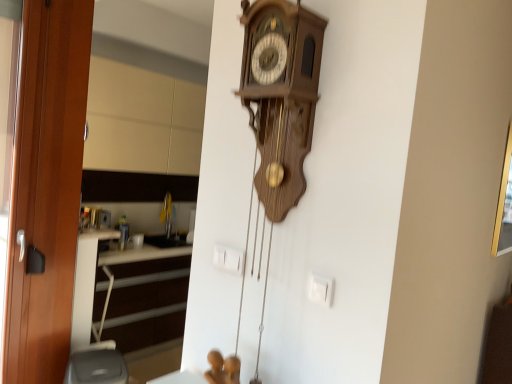
Locate an element on the screen. wooden door at left is located at coordinates (46, 188).

The width and height of the screenshot is (512, 384). Identify the location of wooden door at left. (46, 188).

Could you tell me if beige matte cabinet at upper left is facing white plastic electric outlet at center?

Yes, beige matte cabinet at upper left is aimed at white plastic electric outlet at center.

Does beige matte cabinet at upper left appear on the right side of white plastic electric outlet at center?

Incorrect, beige matte cabinet at upper left is not on the right side of white plastic electric outlet at center.

How distant is beige matte cabinet at upper left from white plastic electric outlet at center?

The distance of beige matte cabinet at upper left from white plastic electric outlet at center is 2.42 meters.

Which of these two, white plastic electric outlet at center or wooden door at left, is thinner?

Thinner between the two is white plastic electric outlet at center.

Is point (236, 270) closer or farther from the camera than point (33, 316)?

Clearly, point (236, 270) is closer to the camera than point (33, 316).

Is wooden door at left at the back of white plastic electric outlet at center?

No.

Based on the photo, from a real-world perspective, between white plastic electric outlet at center and wooden door at left, who is vertically higher?

In real-world perspective, white plastic electric outlet at center is above.

Is gold metallic picture frame at upper right completely or partially outside of wooden door at left?

Yes, gold metallic picture frame at upper right is located beyond the bounds of wooden door at left.

Considering the sizes of objects gold metallic picture frame at upper right and wooden door at left in the image provided, who is thinner, gold metallic picture frame at upper right or wooden door at left?

gold metallic picture frame at upper right.

Is gold metallic picture frame at upper right positioned with its back to wooden door at left?

gold metallic picture frame at upper right is not turned away from wooden door at left.

Does white plastic electric outlet at center have a greater height compared to gold metallic picture frame at upper right?

No.

From the image's perspective, is white plastic electric outlet at center located above gold metallic picture frame at upper right?

Actually, white plastic electric outlet at center appears below gold metallic picture frame at upper right in the image.

Is white plastic electric outlet at center positioned with its back to gold metallic picture frame at upper right?

Yes, white plastic electric outlet at center is facing away from gold metallic picture frame at upper right.

Which object is further away from the camera taking this photo, white plastic electric outlet at center or gold metallic picture frame at upper right?

gold metallic picture frame at upper right.

Is point (51, 295) positioned in front of point (241, 271)?

No.

Considering the relative sizes of wooden door at left and white plastic electric outlet at center in the image provided, is wooden door at left smaller than white plastic electric outlet at center?

Actually, wooden door at left might be larger than white plastic electric outlet at center.

Based on their positions, is wooden door at left located to the left or right of white plastic electric outlet at center?

Clearly, wooden door at left is on the left of white plastic electric outlet at center in the image.

How different are the orientations of wooden door at left and white plastic electric outlet at center in degrees?

The angle between the facing direction of wooden door at left and the facing direction of white plastic electric outlet at center is 89.9 degrees.

In the scene shown: From the image's perspective, is wooden door at left located above or below beige matte cabinet at upper left?

wooden door at left is below beige matte cabinet at upper left.

In order to click on mirror located behind the wooden door at left in this screenshot , I will do `click(144, 105)`.

Who is taller, wooden door at left or beige matte cabinet at upper left?

wooden door at left.

From a real-world perspective, between wooden door at left and beige matte cabinet at upper left, who is vertically higher?

In real-world perspective, beige matte cabinet at upper left is above.

Considering the sizes of objects gold metallic picture frame at upper right and white plastic electric outlet at center in the image provided, who is taller, gold metallic picture frame at upper right or white plastic electric outlet at center?

gold metallic picture frame at upper right is taller.

Is gold metallic picture frame at upper right oriented away from white plastic electric outlet at center?

No, gold metallic picture frame at upper right is not facing away from white plastic electric outlet at center.

From the image's perspective, relative to white plastic electric outlet at center, is gold metallic picture frame at upper right above or below?

gold metallic picture frame at upper right is above white plastic electric outlet at center.

Locate an element on the screen. Image resolution: width=512 pixels, height=384 pixels. electric outlet below the beige matte cabinet at upper left (from a real-world perspective) is located at coordinates (228, 258).

Identify the location of door located above the white plastic electric outlet at center (from the image's perspective). coord(46,188).

Considering their positions, is beige matte cabinet at upper left positioned closer to gold metallic picture frame at upper right than wooden door at left?

The object closer to gold metallic picture frame at upper right is wooden door at left.

When comparing their distances from beige matte cabinet at upper left, does wooden door at left or gold metallic picture frame at upper right seem closer?

Among the two, wooden door at left is located nearer to beige matte cabinet at upper left.

Which object lies further to the anchor point white plastic electric outlet at center, beige matte cabinet at upper left or gold metallic picture frame at upper right?

Among the two, beige matte cabinet at upper left is located further to white plastic electric outlet at center.

Estimate the real-world distances between objects in this image. Which object is closer to beige matte cabinet at upper left, white plastic electric outlet at center or wooden door at left?

wooden door at left is closer to beige matte cabinet at upper left.

From the image, which object appears to be nearer to white plastic electric outlet at center, gold metallic picture frame at upper right or beige matte cabinet at upper left?

gold metallic picture frame at upper right is closer to white plastic electric outlet at center.

Based on their spatial positions, is wooden door at left or gold metallic picture frame at upper right closer to white plastic electric outlet at center?

gold metallic picture frame at upper right lies closer to white plastic electric outlet at center than the other object.

Based on their spatial positions, is gold metallic picture frame at upper right or white plastic electric outlet at center further from beige matte cabinet at upper left?

gold metallic picture frame at upper right is positioned further to the anchor beige matte cabinet at upper left.

Considering their positions, is beige matte cabinet at upper left positioned closer to wooden door at left than gold metallic picture frame at upper right?

Result: beige matte cabinet at upper left.

At what (x,y) coordinates should I click in order to perform the action: click on electric outlet situated between wooden door at left and gold metallic picture frame at upper right from left to right. Please return your answer as a coordinate pair (x, y). The width and height of the screenshot is (512, 384). Looking at the image, I should click on (228, 258).

Find the location of a particular element. The width and height of the screenshot is (512, 384). electric outlet situated between beige matte cabinet at upper left and gold metallic picture frame at upper right from left to right is located at coordinates (228, 258).

Image resolution: width=512 pixels, height=384 pixels. I want to click on door between white plastic electric outlet at center and beige matte cabinet at upper left from front to back, so click(46, 188).

This screenshot has width=512, height=384. What are the coordinates of `mirror situated between wooden door at left and gold metallic picture frame at upper right from left to right` in the screenshot? It's located at (144, 105).